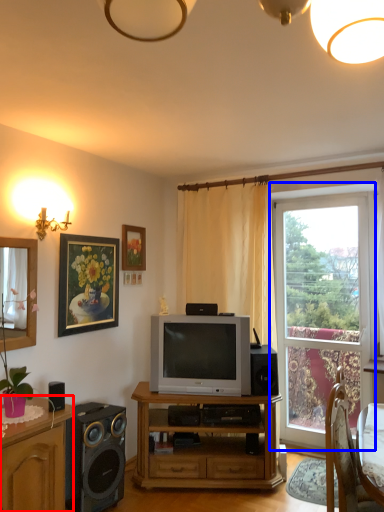
Question: Which object appears closest to the camera in this image, cabinetry (highlighted by a red box) or window (highlighted by a blue box)?

Choices:
 (A) cabinetry
 (B) window

Answer: (A)